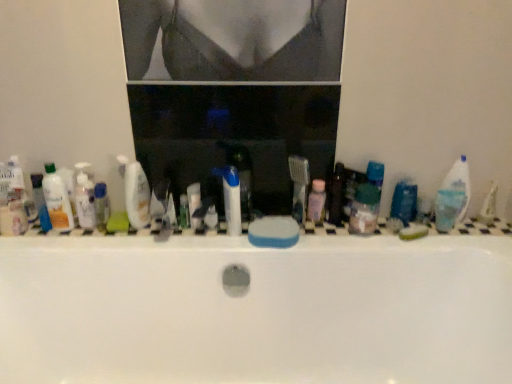
Question: Can you confirm if translucent plastic bottle at left, marked as the 1th toiletry in a left-to-right arrangement, is thinner than translucent plastic bottle at left, which ranks as the 3th toiletry in right-to-left order?

Choices:
 (A) yes
 (B) no

Answer: (B)

Question: Is translucent plastic bottle at left, which ranks as the 4th toiletry in right-to-left order, positioned beyond the bounds of translucent plastic bottle at left, which ranks as the 3th toiletry in right-to-left order?

Choices:
 (A) yes
 (B) no

Answer: (A)

Question: Does translucent plastic bottle at left, which ranks as the 4th toiletry in right-to-left order, lie in front of translucent plastic bottle at left, the 2th toiletry when ordered from left to right?

Choices:
 (A) yes
 (B) no

Answer: (A)

Question: Considering the relative sizes of translucent plastic bottle at left, marked as the 1th toiletry in a left-to-right arrangement, and translucent plastic bottle at left, which ranks as the 3th toiletry in right-to-left order, in the image provided, is translucent plastic bottle at left, marked as the 1th toiletry in a left-to-right arrangement, bigger than translucent plastic bottle at left, which ranks as the 3th toiletry in right-to-left order,?

Choices:
 (A) no
 (B) yes

Answer: (B)

Question: Is translucent plastic bottle at left, marked as the 1th toiletry in a left-to-right arrangement, turned away from translucent plastic bottle at left, which ranks as the 3th toiletry in right-to-left order?

Choices:
 (A) no
 (B) yes

Answer: (A)

Question: From a real-world perspective, is translucent plastic bottle at left, which ranks as the 4th toiletry in right-to-left order, physically above translucent plastic bottle at left, which ranks as the 3th toiletry in right-to-left order?

Choices:
 (A) no
 (B) yes

Answer: (B)

Question: Are white plastic bottles at center and blue sponge at center, which ranks as the second soap in right-to-left order, far apart?

Choices:
 (A) yes
 (B) no

Answer: (B)

Question: From a real-world perspective, is white plastic bottles at center physically below blue sponge at center, which ranks as the second soap in right-to-left order?

Choices:
 (A) yes
 (B) no

Answer: (A)

Question: Does white plastic bottles at center appear on the right side of blue sponge at center, which ranks as the second soap in right-to-left order?

Choices:
 (A) no
 (B) yes

Answer: (A)

Question: Considering the relative sizes of white plastic bottles at center and blue sponge at center, the 1th soap viewed from the left, in the image provided, is white plastic bottles at center taller than blue sponge at center, the 1th soap viewed from the left,?

Choices:
 (A) no
 (B) yes

Answer: (A)

Question: Is white plastic bottles at center smaller than blue sponge at center, the 1th soap viewed from the left?

Choices:
 (A) no
 (B) yes

Answer: (A)

Question: Could you tell me if white plastic bottles at center is turned towards blue sponge at center, the 1th soap viewed from the left?

Choices:
 (A) no
 (B) yes

Answer: (B)

Question: Does translucent plastic bottle at left, marked as the 1th toiletry in a left-to-right arrangement, come behind pink translucent bottle at center, the 4th toiletry positioned from the left?

Choices:
 (A) no
 (B) yes

Answer: (A)